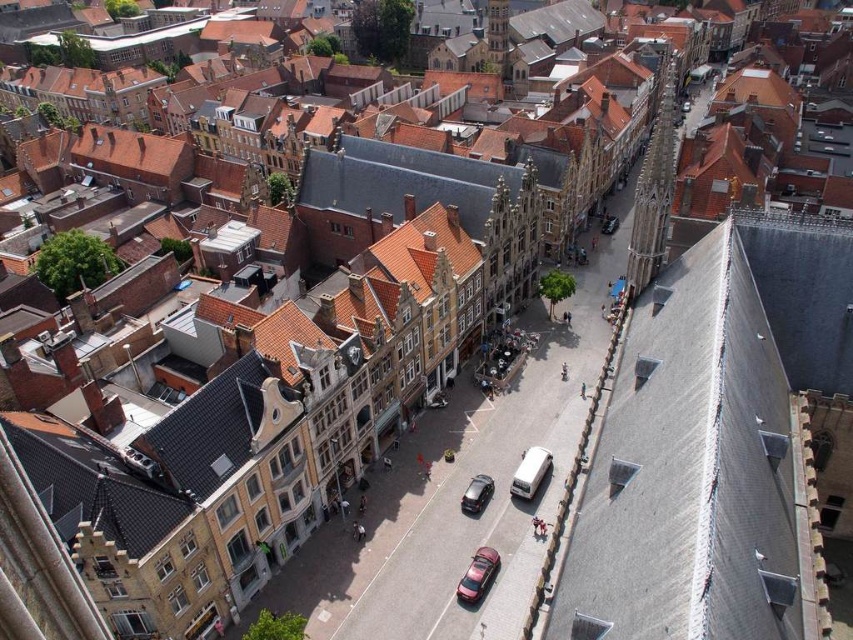
Which of these two, white matte van at center-right or shiny black car at center, stands shorter?

Standing shorter between the two is white matte van at center-right.

Does white matte van at center-right appear on the left side of shiny black car at center?

No, white matte van at center-right is not to the left of shiny black car at center.

Between point (544, 476) and point (479, 500), which one is positioned in front?

Point (479, 500)

Locate an element on the screen. The height and width of the screenshot is (640, 853). white matte van at center-right is located at coordinates (531, 472).

Image resolution: width=853 pixels, height=640 pixels. Describe the element at coordinates (479, 576) in the screenshot. I see `shiny red car at center` at that location.

Does shiny red car at center appear on the left side of shiny black car at center?

Indeed, shiny red car at center is positioned on the left side of shiny black car at center.

This screenshot has width=853, height=640. In order to click on shiny red car at center in this screenshot , I will do `click(479, 576)`.

This screenshot has width=853, height=640. In order to click on shiny red car at center in this screenshot , I will do `click(479, 576)`.

Which is in front, point (471, 596) or point (531, 483)?

Point (471, 596)

Where is `shiny red car at center`? Image resolution: width=853 pixels, height=640 pixels. shiny red car at center is located at coordinates (479, 576).

Image resolution: width=853 pixels, height=640 pixels. I want to click on shiny red car at center, so coord(479,576).